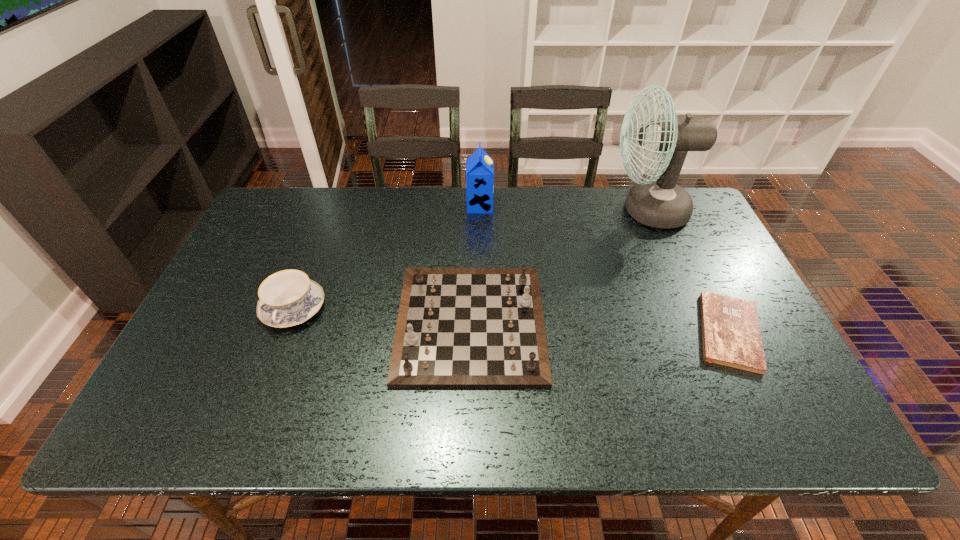
The width and height of the screenshot is (960, 540). Identify the location of free space in the image that satisfies the following two spatial constraints: 1. with the handle on the side of the Bible; 2. on the right side of the leftmost object. (284, 332).

Where is `free location that satisfies the following two spatial constraints: 1. on the back side of the Bible; 2. with the cap open on the second tallest object`? Image resolution: width=960 pixels, height=540 pixels. free location that satisfies the following two spatial constraints: 1. on the back side of the Bible; 2. with the cap open on the second tallest object is located at coordinates (668, 206).